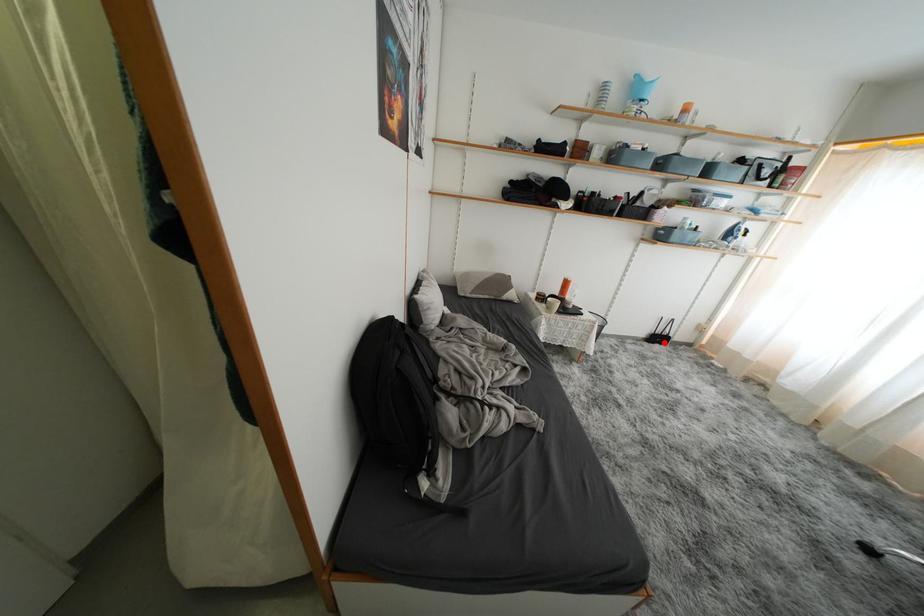
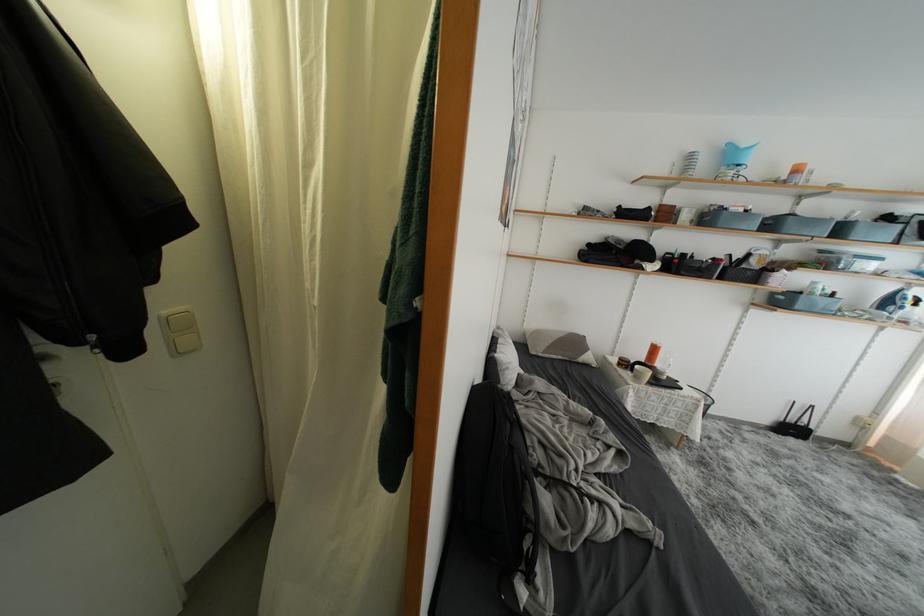
Locate, in the second image, the point that corresponds to the highlighted location in the first image.

(797, 434)